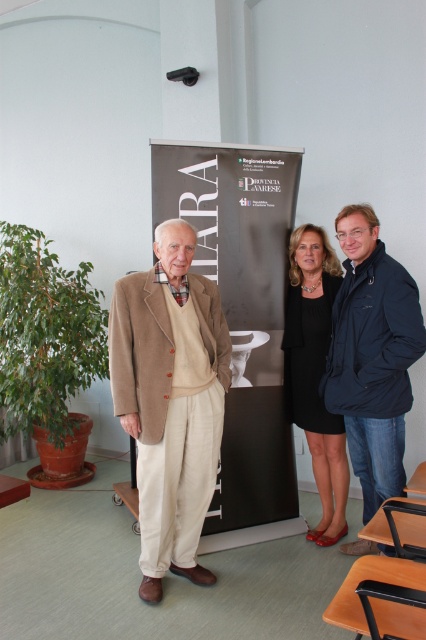
Which is more to the right, beige woolen coat at center or dark blue jacket at center?

dark blue jacket at center is more to the right.

Between beige woolen coat at center and dark blue jacket at center, which one has more height?

dark blue jacket at center

What do you see at coordinates (170, 401) in the screenshot? I see `beige woolen coat at center` at bounding box center [170, 401].

The height and width of the screenshot is (640, 426). Find the location of `beige woolen coat at center`. beige woolen coat at center is located at coordinates (170, 401).

Does dark blue jacket at center lie in front of black satin dress at center?

Yes.

Measure the distance between dark blue jacket at center and camera.

dark blue jacket at center is 7.99 feet from camera.

Locate an element on the screen. dark blue jacket at center is located at coordinates (371, 355).

Is beige woolen coat at center smaller than black satin dress at center?

Incorrect, beige woolen coat at center is not smaller in size than black satin dress at center.

Is beige woolen coat at center thinner than black satin dress at center?

In fact, beige woolen coat at center might be wider than black satin dress at center.

Who is more distant from viewer, (192,406) or (313,321)?

Positioned behind is point (313,321).

You are a GUI agent. You are given a task and a screenshot of the screen. Output one action in this format:
    pyautogui.click(x=<x>, y=<y>)
    Task: Click on the beige woolen coat at center
    This screenshot has height=640, width=426.
    Given the screenshot: What is the action you would take?
    pyautogui.click(x=170, y=401)